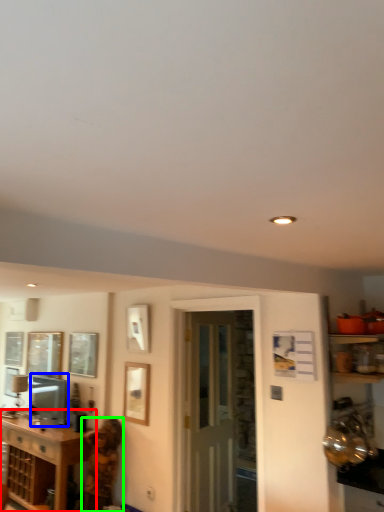
Question: Which object is positioned closest to cabinetry (highlighted by a red box)? Select from appliance (highlighted by a blue box) and person (highlighted by a green box).

Choices:
 (A) appliance
 (B) person

Answer: (B)